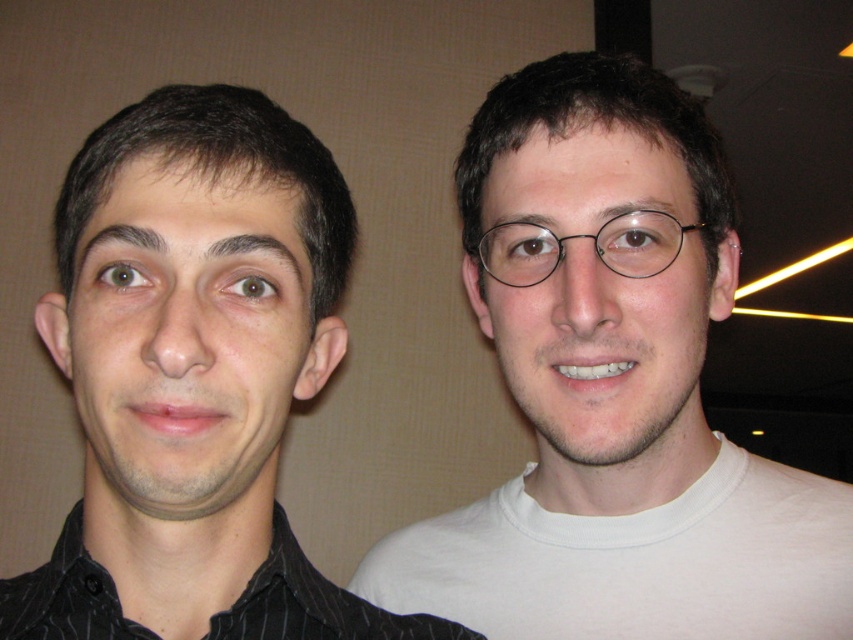
Question: Is white cotton t-shirt at right above clear skin glasses at right?

Choices:
 (A) no
 (B) yes

Answer: (A)

Question: Which object appears farthest from the camera in this image?

Choices:
 (A) black striped shirt at left
 (B) white cotton t-shirt at right
 (C) matte black face at left
 (D) black pinstripe shirt at left

Answer: (B)

Question: Does white cotton t-shirt at right have a larger size compared to clear skin glasses at right?

Choices:
 (A) yes
 (B) no

Answer: (A)

Question: Which object is closer to the camera taking this photo?

Choices:
 (A) black striped shirt at left
 (B) white matte shirt at right
 (C) white cotton t-shirt at right
 (D) matte black face at left

Answer: (A)

Question: Is matte black face at left thinner than clear skin glasses at right?

Choices:
 (A) yes
 (B) no

Answer: (A)

Question: Which object appears closest to the camera in this image?

Choices:
 (A) clear skin glasses at right
 (B) white cotton t-shirt at right

Answer: (A)